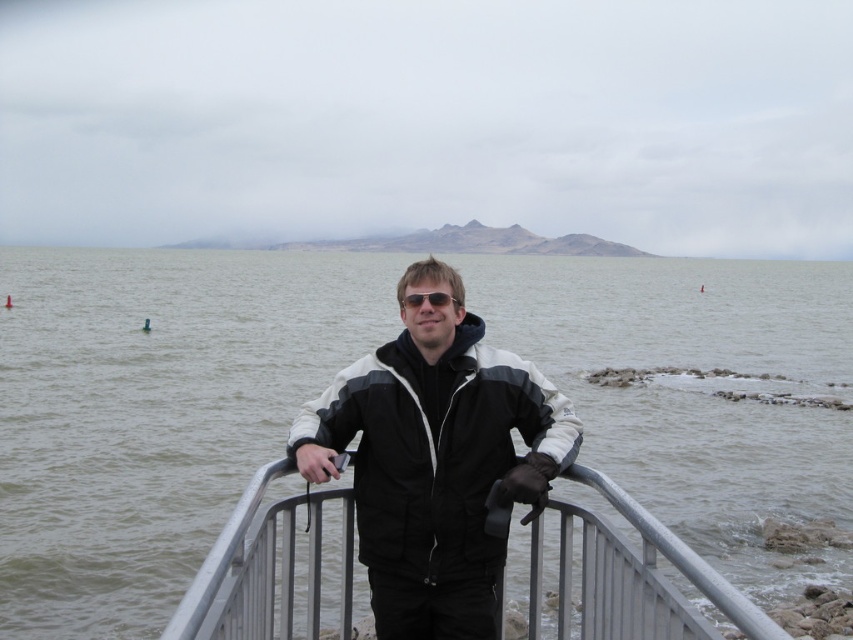
Is black matte jacket at center wider than silver metallic fence at center?

Correct, the width of black matte jacket at center exceeds that of silver metallic fence at center.

Which is below, black matte jacket at center or silver metallic fence at center?

silver metallic fence at center is below.

Measure the distance between point (413, 349) and camera.

Point (413, 349) is 14.19 feet away from camera.

Find the location of a particular element. This screenshot has width=853, height=640. black matte jacket at center is located at coordinates pos(436,460).

Between black matte jacket at center and sunglasses at center, which one is positioned lower?

black matte jacket at center is lower down.

Does black matte jacket at center have a lesser width compared to sunglasses at center?

No, black matte jacket at center is not thinner than sunglasses at center.

This screenshot has width=853, height=640. In order to click on black matte jacket at center in this screenshot , I will do `click(436, 460)`.

Can you confirm if silver metallic fence at center is positioned to the left of sunglasses at center?

Indeed, silver metallic fence at center is positioned on the left side of sunglasses at center.

Identify the location of silver metallic fence at center. The image size is (853, 640). (270, 568).

Who is more distant from viewer, (625, 577) or (460, 305)?

Positioned behind is point (460, 305).

Locate an element on the screen. The height and width of the screenshot is (640, 853). silver metallic fence at center is located at coordinates (270, 568).